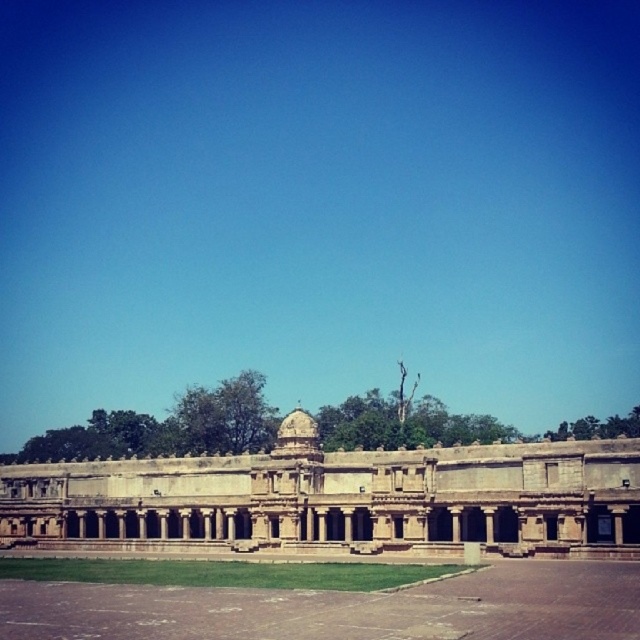
Question: Is beige stone palace at center positioned at the back of green grass at center?

Choices:
 (A) no
 (B) yes

Answer: (B)

Question: Which point appears farthest from the camera in this image?

Choices:
 (A) (212, 467)
 (B) (584, 561)

Answer: (A)

Question: Which point appears closest to the camera in this image?

Choices:
 (A) (458, 467)
 (B) (76, 618)

Answer: (B)

Question: Is beige stone palace at center to the right of green grass at center from the viewer's perspective?

Choices:
 (A) no
 (B) yes

Answer: (A)

Question: Can you confirm if beige stone palace at center is thinner than green grass at center?

Choices:
 (A) no
 (B) yes

Answer: (A)